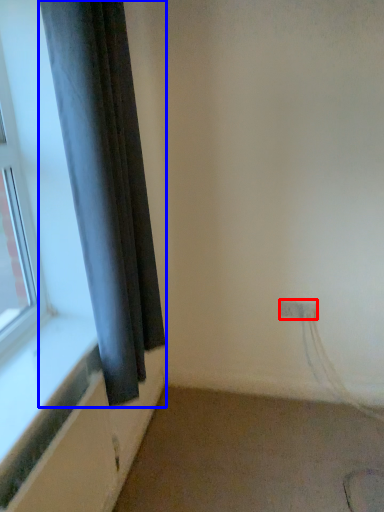
Question: Which point is further to the camera, electric outlet (highlighted by a red box) or curtain (highlighted by a blue box)?

Choices:
 (A) electric outlet
 (B) curtain

Answer: (A)